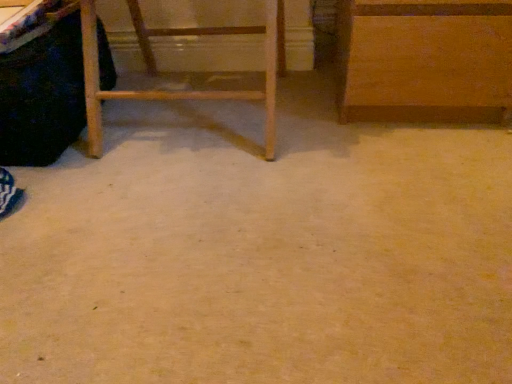
Identify the location of free space that is in between wooden cabinet at upper right, arranged as the first furniture when viewed from the right, and wooden ladder at left, the 2th furniture when ordered from right to left. (313, 110).